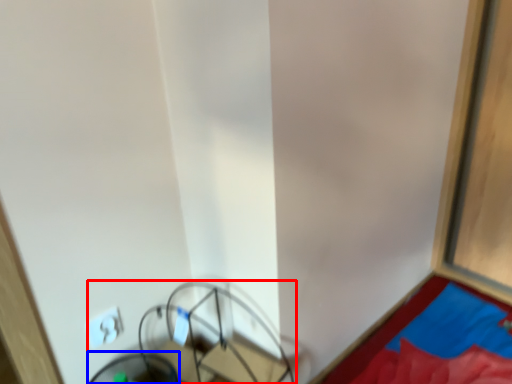
Question: Which of the following is the farthest to the observer, furniture (highlighted by a red box) or swivel chair (highlighted by a blue box)?

Choices:
 (A) furniture
 (B) swivel chair

Answer: (B)